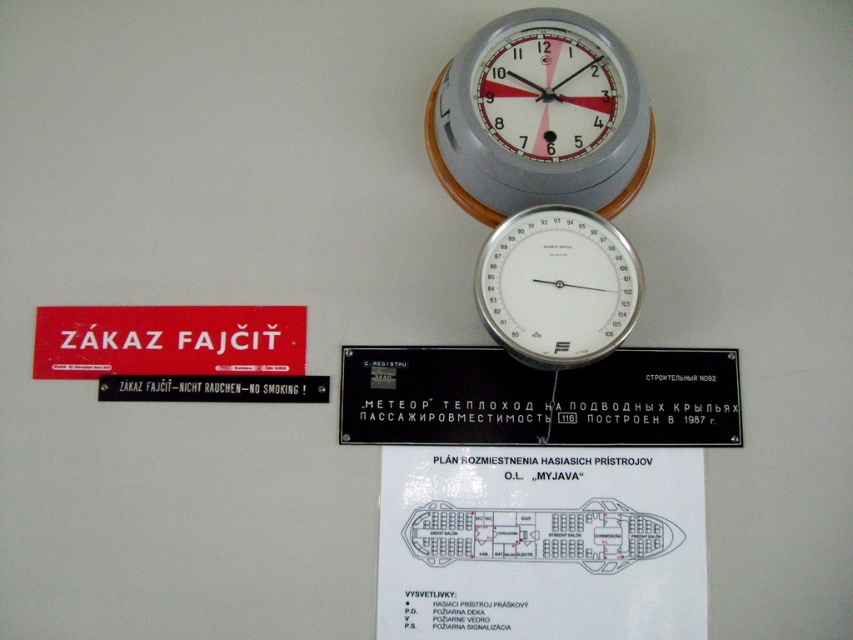
Question: Estimate the real-world distances between objects in this image. Which object is closer to the red plastic sign at left?

Choices:
 (A) black plastic sign at upper center
 (B) matte gray clock at upper center
 (C) black plastic sign at left
 (D) silver metallic thermometer at upper center

Answer: (C)

Question: Is black plastic sign at upper center above silver metallic thermometer at upper center?

Choices:
 (A) yes
 (B) no

Answer: (B)

Question: From the image, what is the correct spatial relationship of matte gray clock at upper center in relation to silver metallic thermometer at upper center?

Choices:
 (A) below
 (B) above

Answer: (B)

Question: Which of the following is the closest to the observer?

Choices:
 (A) (583, 396)
 (B) (514, 273)
 (C) (514, 90)
 (D) (285, 369)

Answer: (B)

Question: Which point is farther to the camera?

Choices:
 (A) (113, 358)
 (B) (515, 513)

Answer: (A)

Question: Is white paper at center above silver metallic thermometer at upper center?

Choices:
 (A) no
 (B) yes

Answer: (A)